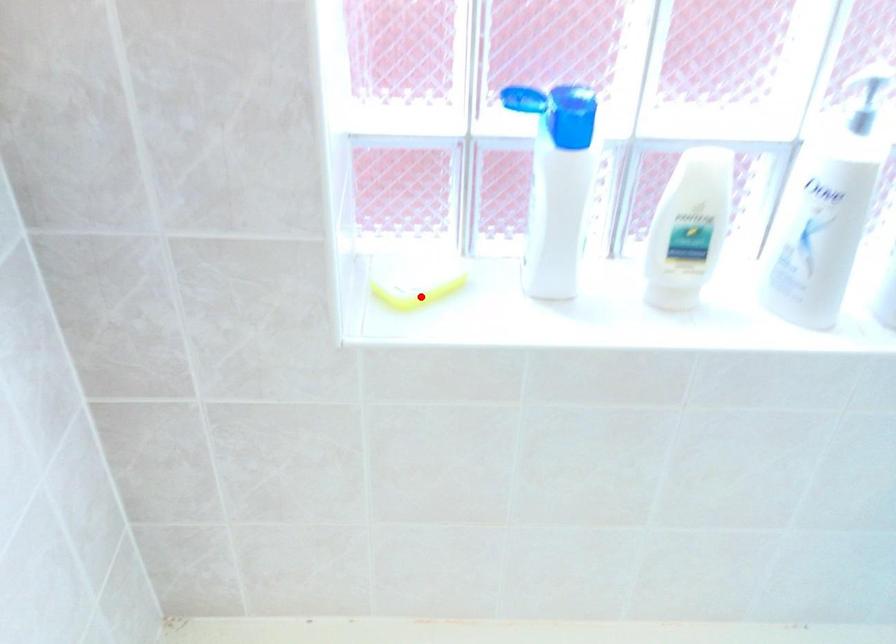
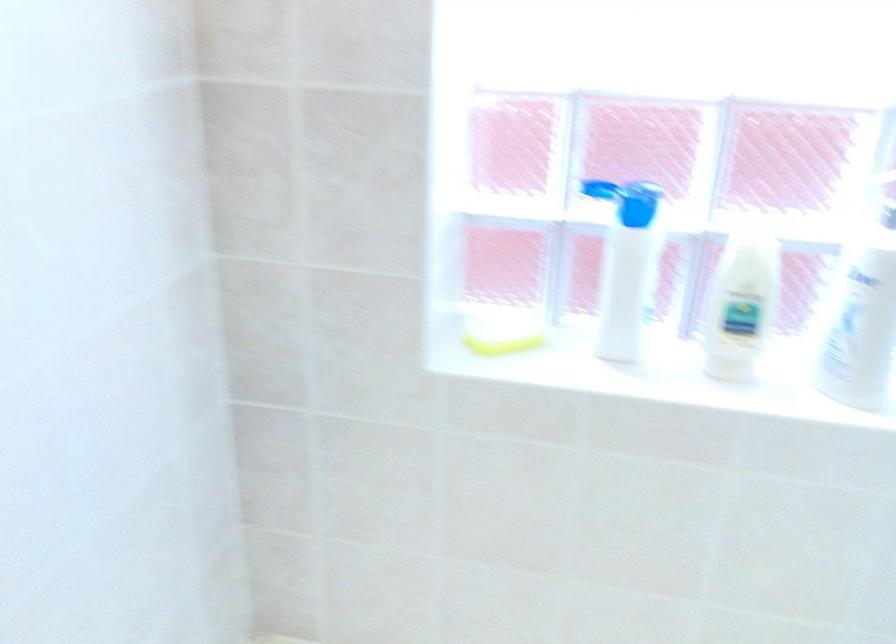
Question: I am providing you with two images of the same scene from different viewpoints. A red point is shown in image1. For the corresponding object point in image2, is it positioned nearer or farther from the camera?

Choices:
 (A) Nearer
 (B) Farther

Answer: (B)